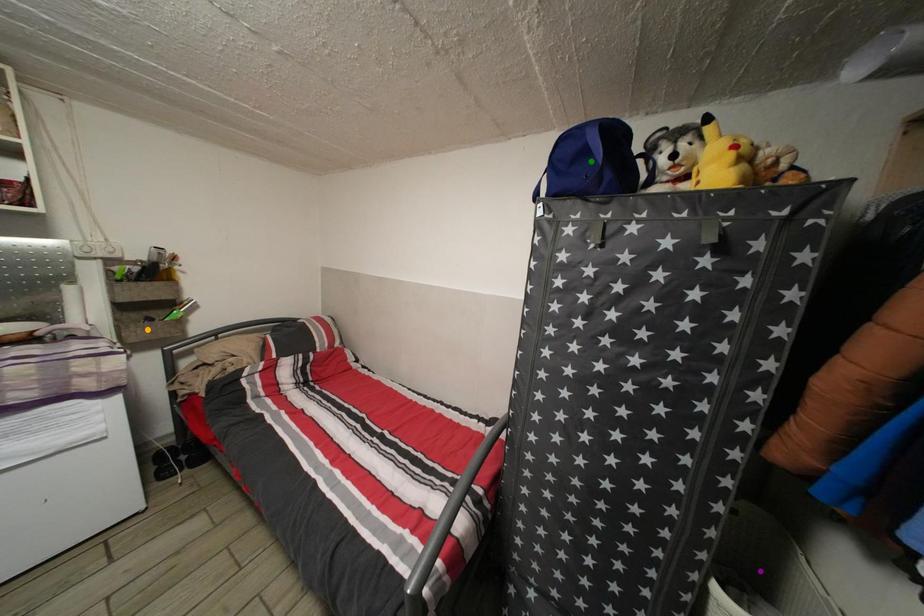
Order these from nearest to farthest:
A) purple point
B) green point
C) orange point

purple point < green point < orange point